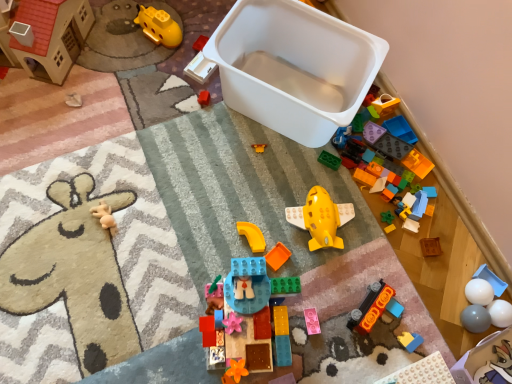
At what (x,y) coordinates should I click in order to perform the action: click on free space in front of pink matte block at center, the 7th toy from the left. Please return your answer as a coordinate pair (x, y). The image size is (512, 384). Looking at the image, I should click on (308, 360).